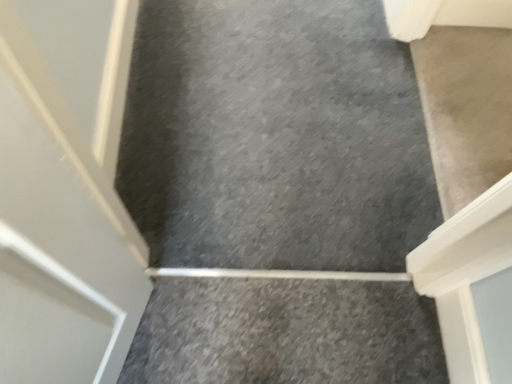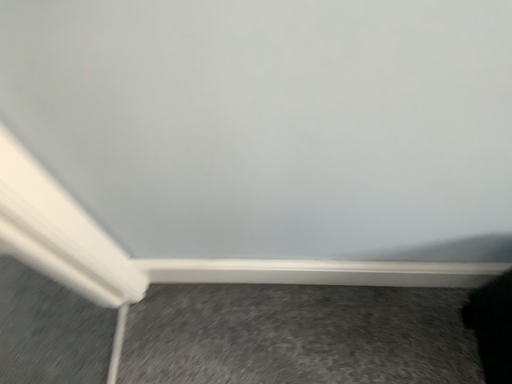
Question: How did the camera likely rotate when shooting the video?

Choices:
 (A) rotated left
 (B) rotated right

Answer: (B)